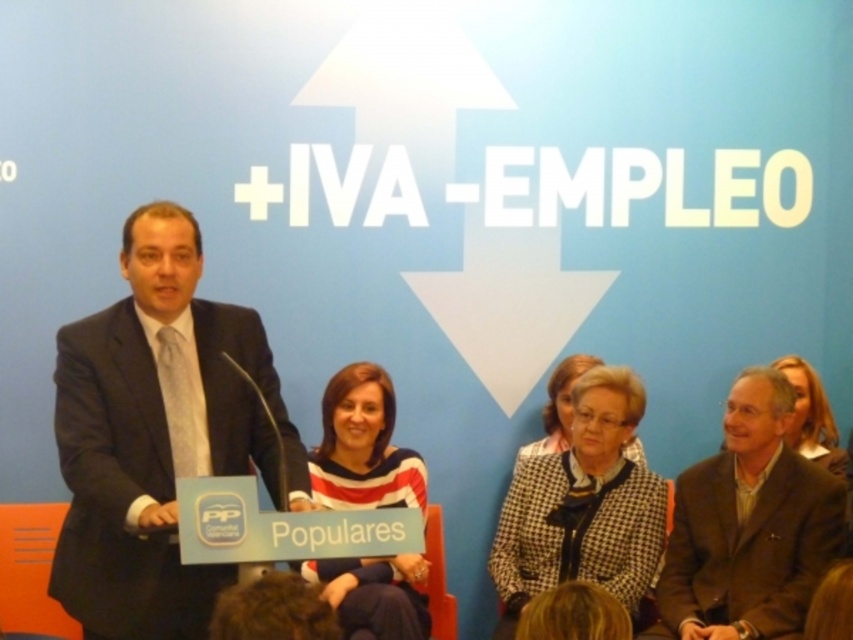
Question: Which point is farther from the camera taking this photo?

Choices:
 (A) (659, 570)
 (B) (798, 360)
 (C) (213, 472)
 (D) (519, 458)

Answer: (D)

Question: Is striped fabric shirt at center to the right of smooth beige blazer at center from the viewer's perspective?

Choices:
 (A) yes
 (B) no

Answer: (B)

Question: Does dark gray suit at left appear over checkered fabric jacket at center?

Choices:
 (A) yes
 (B) no

Answer: (A)

Question: Is brown woolen suit at center wider than smooth beige blazer at center?

Choices:
 (A) yes
 (B) no

Answer: (A)

Question: Which object is closer to the camera taking this photo?

Choices:
 (A) smooth beige blazer at center
 (B) striped fabric shirt at center

Answer: (B)

Question: Which object appears closest to the camera in this image?

Choices:
 (A) brown woolen suit at center
 (B) striped fabric shirt at center
 (C) dark gray suit at left

Answer: (C)